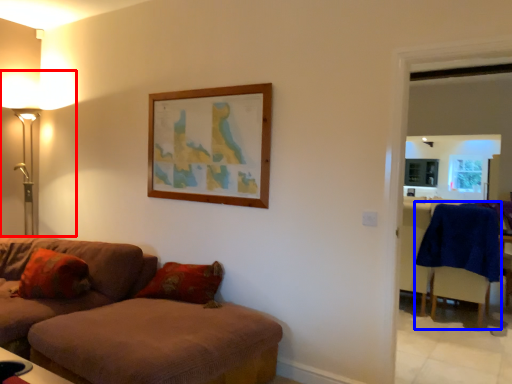
Question: Which object is closer to the camera taking this photo, table lamp (highlighted by a red box) or swivel chair (highlighted by a blue box)?

Choices:
 (A) table lamp
 (B) swivel chair

Answer: (A)